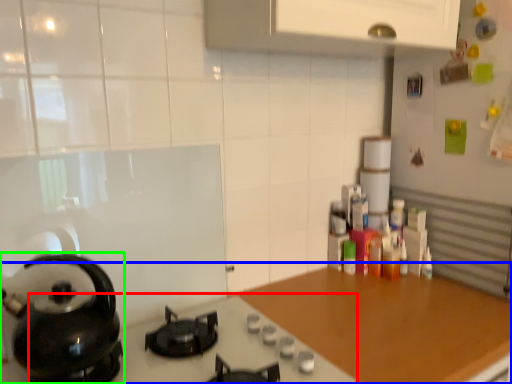
Question: Based on their relative distances, which object is nearer to gas stove (highlighted by a red box)? Choose from countertop (highlighted by a blue box) and kitchen appliance (highlighted by a green box).

Choices:
 (A) countertop
 (B) kitchen appliance

Answer: (A)